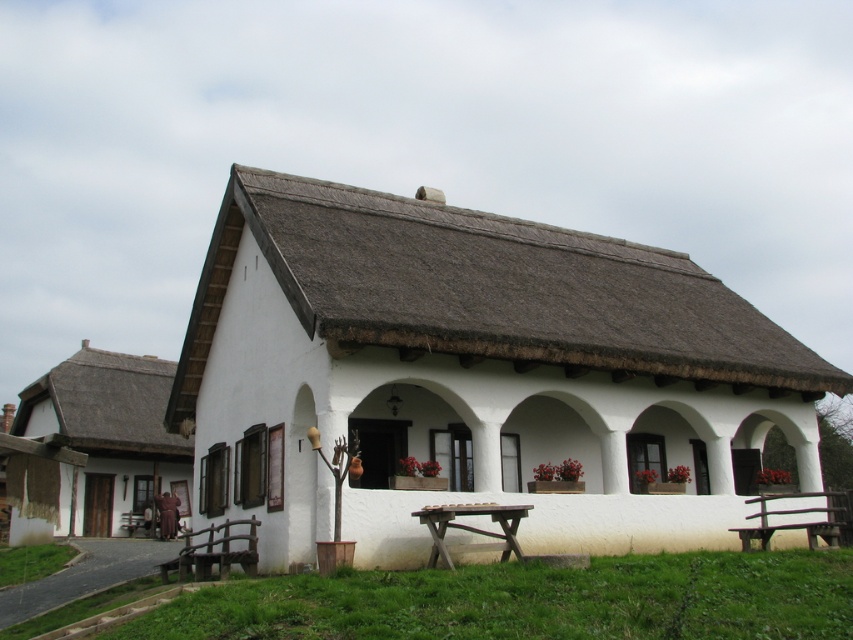
Question: Which of the following is the closest to the observer?

Choices:
 (A) (460, 506)
 (B) (550, 506)

Answer: (A)

Question: Does white stucco cottage at center have a larger size compared to white thatched roof cottage at left?

Choices:
 (A) no
 (B) yes

Answer: (A)

Question: Which object is the farthest from the white thatched roof cottage at left?

Choices:
 (A) brown wooden picnic table at lower center
 (B) white stucco cottage at center

Answer: (A)

Question: Is white thatched roof cottage at left further to the viewer compared to brown wooden picnic table at lower center?

Choices:
 (A) no
 (B) yes

Answer: (B)

Question: Among these points, which one is farthest from the camera?

Choices:
 (A) (292, 440)
 (B) (115, 534)
 (C) (467, 552)

Answer: (B)

Question: Where is white thatched roof cottage at left located in relation to brown wooden picnic table at lower center in the image?

Choices:
 (A) right
 (B) left

Answer: (B)